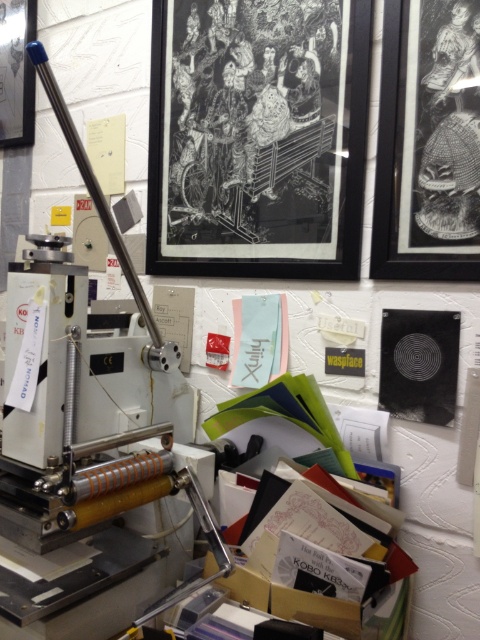
You are an art curator examining the studio layout. You notice two framed artworks on the wall. Which of the two frames, the black matte picture frame at upper right or the matte black picture frame at upper left, has a greater height?

The black matte picture frame at upper right is much taller than the matte black picture frame at upper left.